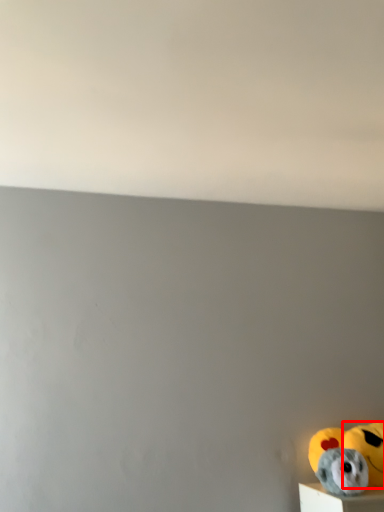
Question: From the image, what is the correct spatial relationship of stuffed animal (annotated by the red box) in relation to toy?

Choices:
 (A) left
 (B) right

Answer: (B)